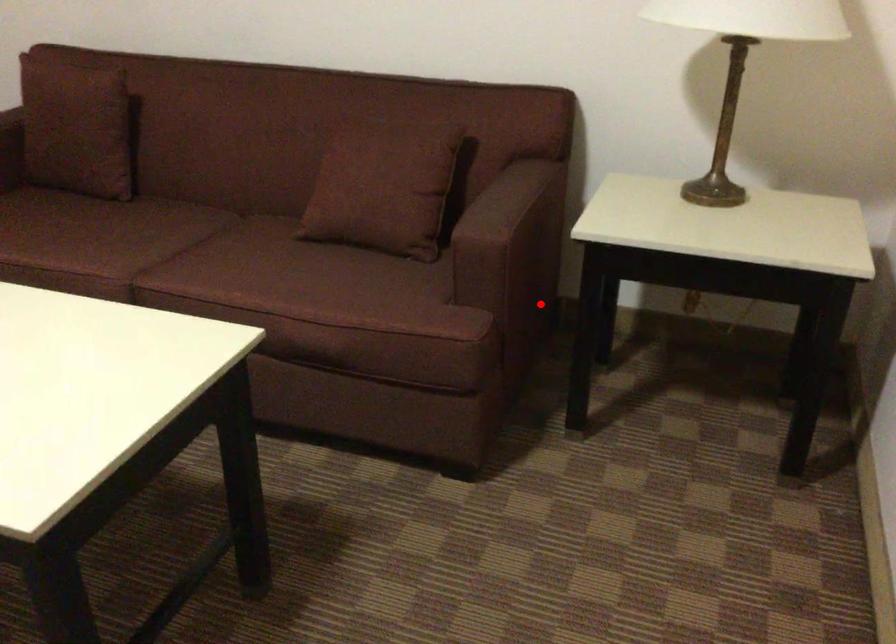
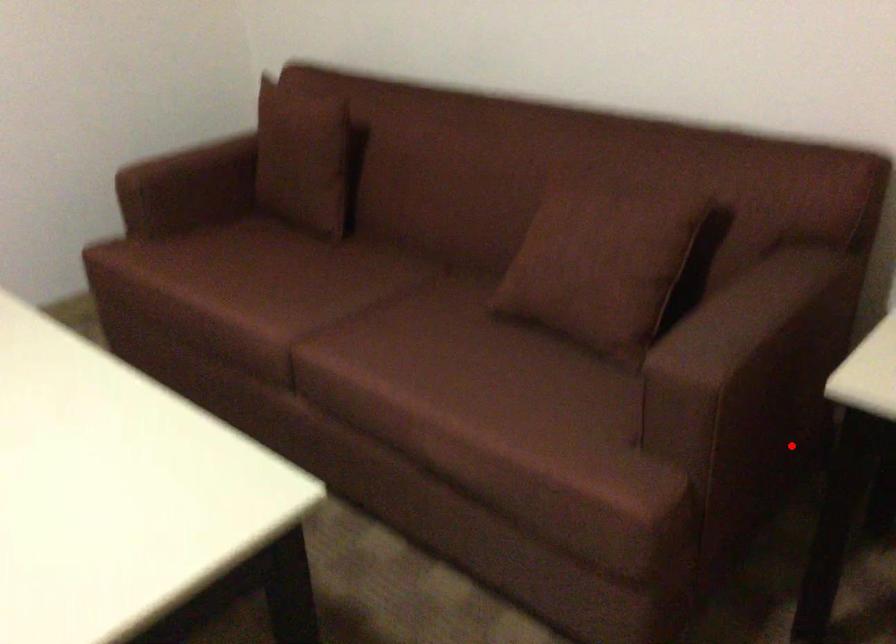
I am providing you with two images of the same scene from different viewpoints. A red point is marked on the first image and another point is marked on the second image. Do the highlighted points in image1 and image2 indicate the same real-world spot?

Yes